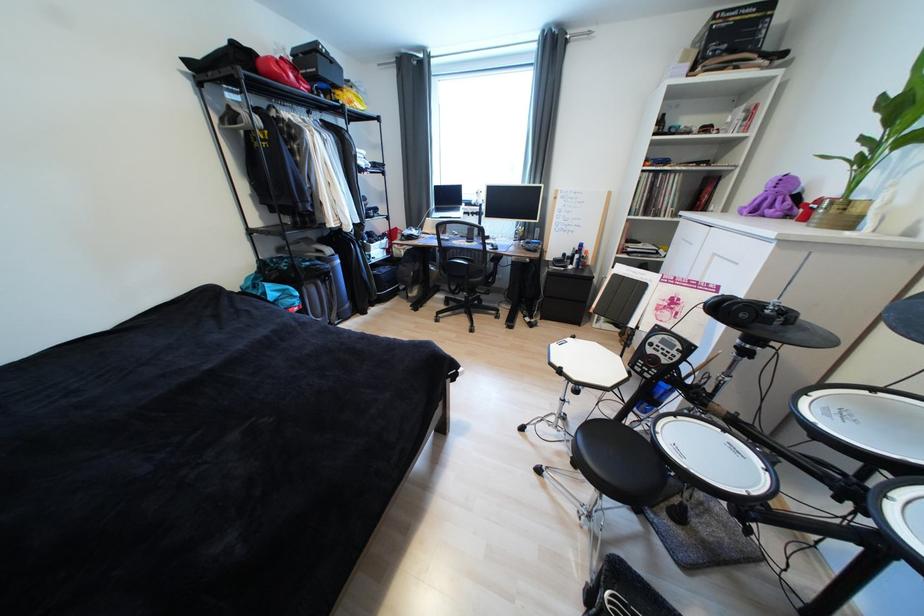
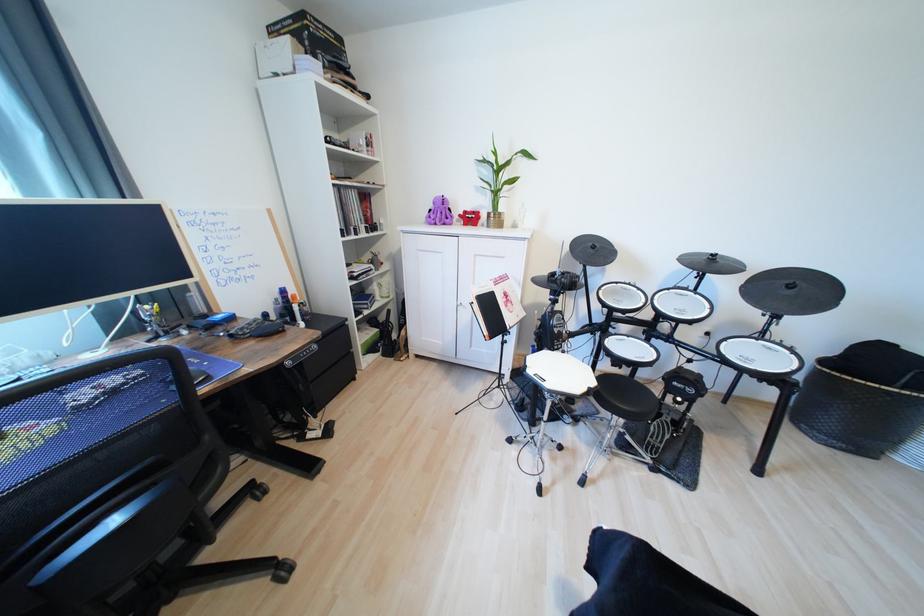
The point at (787,204) is marked in the first image. Where is the corresponding point in the second image?

(447, 216)